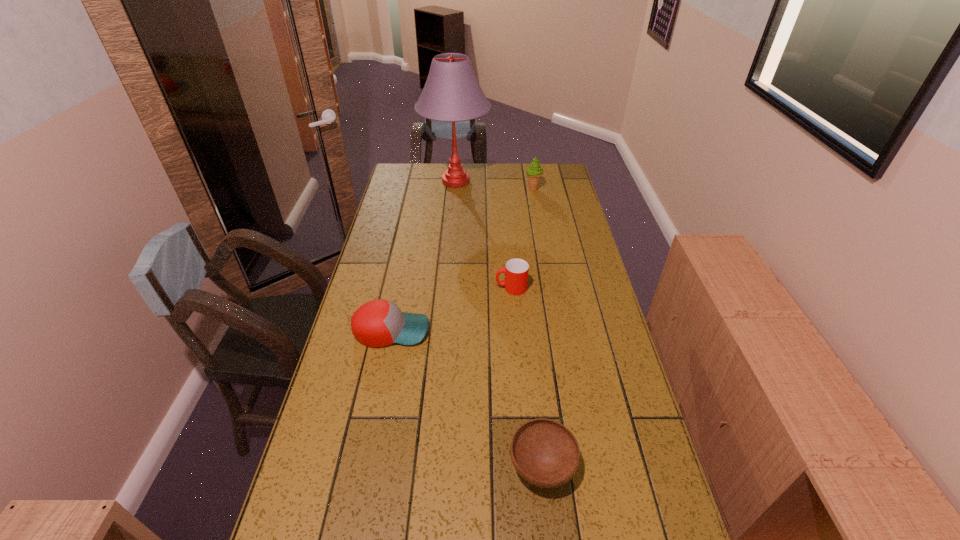
At what (x,y) coordinates should I click in order to perform the action: click on blank space at the left edge of the desktop. Please return your answer as a coordinate pair (x, y). Image resolution: width=960 pixels, height=540 pixels. Looking at the image, I should click on (415, 212).

The width and height of the screenshot is (960, 540). I want to click on free space at the right edge, so click(590, 289).

Locate an element on the screen. The width and height of the screenshot is (960, 540). free space at the far left corner of the desktop is located at coordinates (424, 183).

The height and width of the screenshot is (540, 960). In the image, there is a desktop. Identify the location of vacant area at the far right corner. (550, 174).

Locate an element on the screen. free point between the table lamp and the cup is located at coordinates (484, 235).

Where is `vacant space that is in between the second tallest object and the nearest object`? The image size is (960, 540). vacant space that is in between the second tallest object and the nearest object is located at coordinates (538, 328).

At what (x,y) coordinates should I click in order to perform the action: click on free space between the nearest object and the fourth farthest object. Please return your answer as a coordinate pair (x, y). The height and width of the screenshot is (540, 960). Looking at the image, I should click on (467, 399).

The image size is (960, 540). What are the coordinates of `unoccupied area between the cup and the bowl` in the screenshot? It's located at [x=527, y=377].

At what (x,y) coordinates should I click in order to perform the action: click on free space between the third nearest object and the baseball cap. Please return your answer as a coordinate pair (x, y). This screenshot has height=540, width=960. Looking at the image, I should click on (451, 309).

The image size is (960, 540). In order to click on object that is the second closest to the cup in this screenshot , I will do `click(545, 453)`.